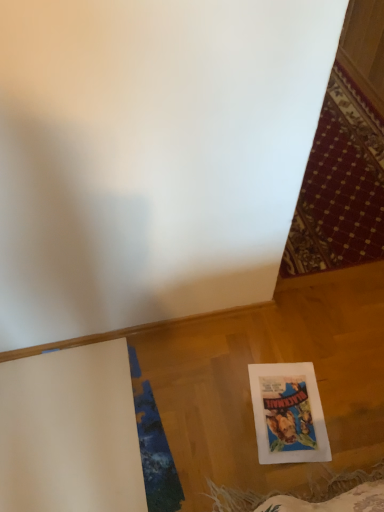
Locate an element on the screen. Image resolution: width=384 pixels, height=512 pixels. blank space situated above white paper at lower right (from a real-world perspective) is located at coordinates (291, 408).